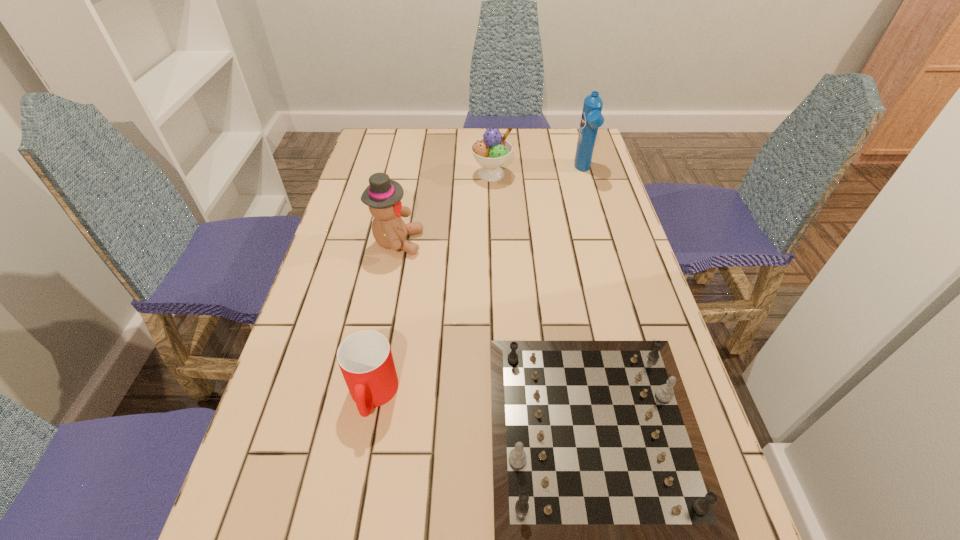
I want to click on empty space that is in between the rag_doll and the shampoo, so [x=491, y=206].

The width and height of the screenshot is (960, 540). Find the location of `unoccupied area between the fourth tallest object and the third nearest object`. unoccupied area between the fourth tallest object and the third nearest object is located at coordinates (385, 319).

Locate which object ranks fourth in proximity to the second shortest object. Please provide its 2D coordinates. Your answer should be formatted as a tuple, i.e. [(x, y)], where the tuple contains the x and y coordinates of a point satisfying the conditions above.

[(592, 118)]

Locate an element on the screen. This screenshot has height=540, width=960. the third closest object relative to the fourth tallest object is located at coordinates (492, 151).

Find the location of a particular element. The width and height of the screenshot is (960, 540). vacant space that satisfies the following two spatial constraints: 1. on the front side of the tallest object; 2. on the front-facing side of the third nearest object is located at coordinates (604, 242).

Image resolution: width=960 pixels, height=540 pixels. Identify the location of vacant space that satisfies the following two spatial constraints: 1. on the front side of the icecream; 2. on the front-facing side of the rag_doll. (493, 242).

You are a GUI agent. You are given a task and a screenshot of the screen. Output one action in this format:
    pyautogui.click(x=<x>, y=<y>)
    Task: Click on the vacant space that satisfies the following two spatial constraints: 1. on the front side of the third tallest object; 2. on the front-facing side of the third nearest object
    Image resolution: width=960 pixels, height=540 pixels.
    Given the screenshot: What is the action you would take?
    pyautogui.click(x=493, y=242)